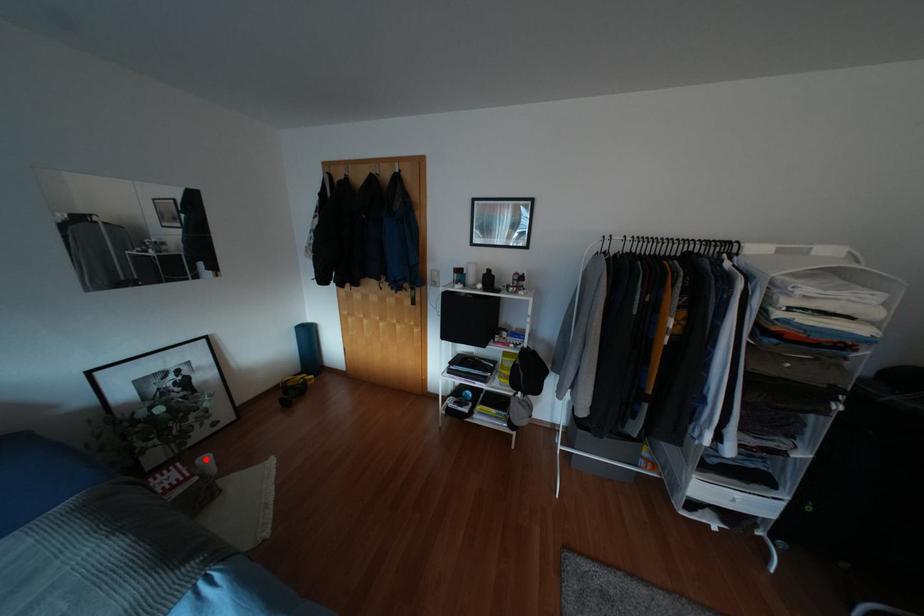
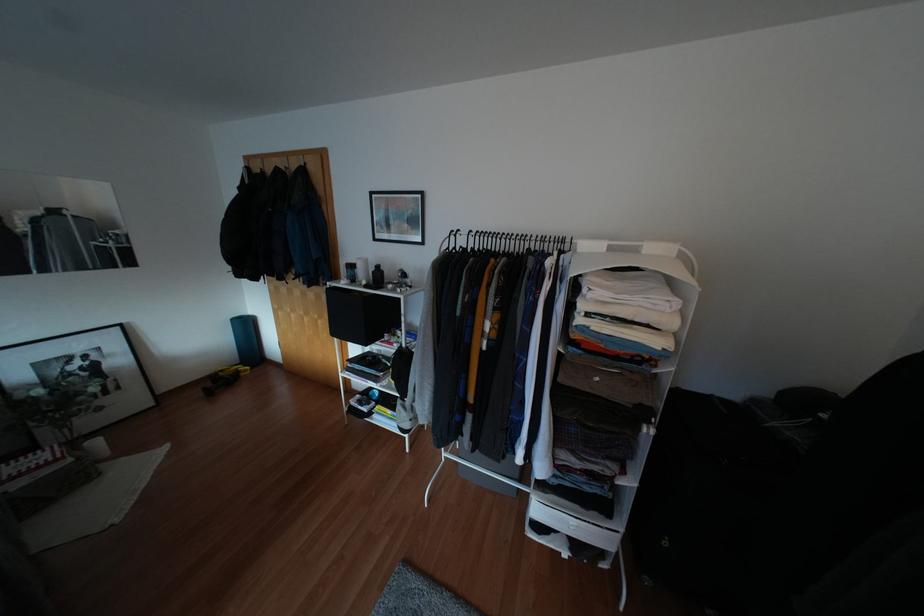
Question: I am providing you with two images of the same scene from different viewpoints. Image1 has a red point marked. In image2, the corresponding 3D location appears at what relative position? Reply with the corresponding letter.

Choices:
 (A) Closer
 (B) Farther

Answer: (B)